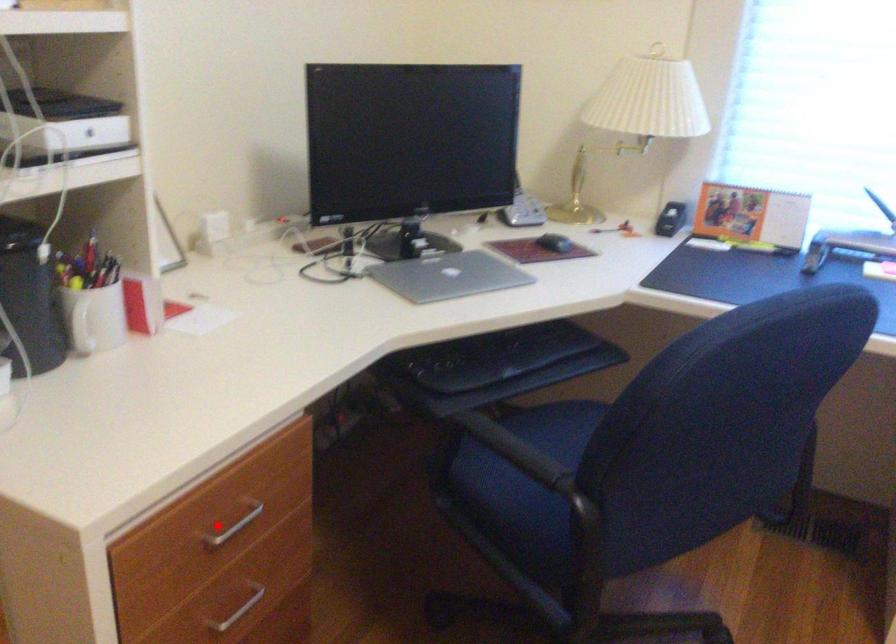
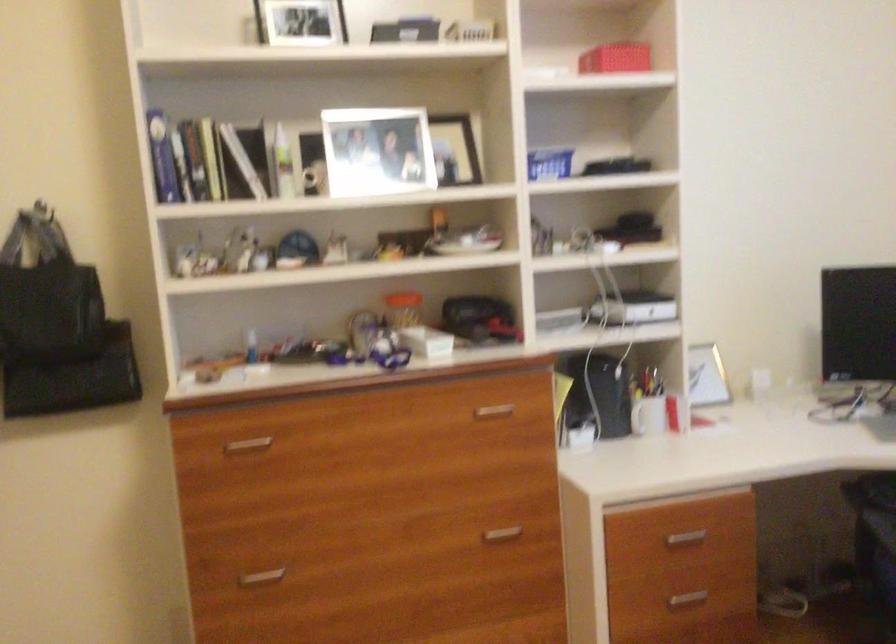
Question: I am providing you with two images of the same scene from different viewpoints. Given a red point in image1, look at the same physical point in image2. Is it:

Choices:
 (A) Closer to the viewpoint
 (B) Farther from the viewpoint

Answer: (B)